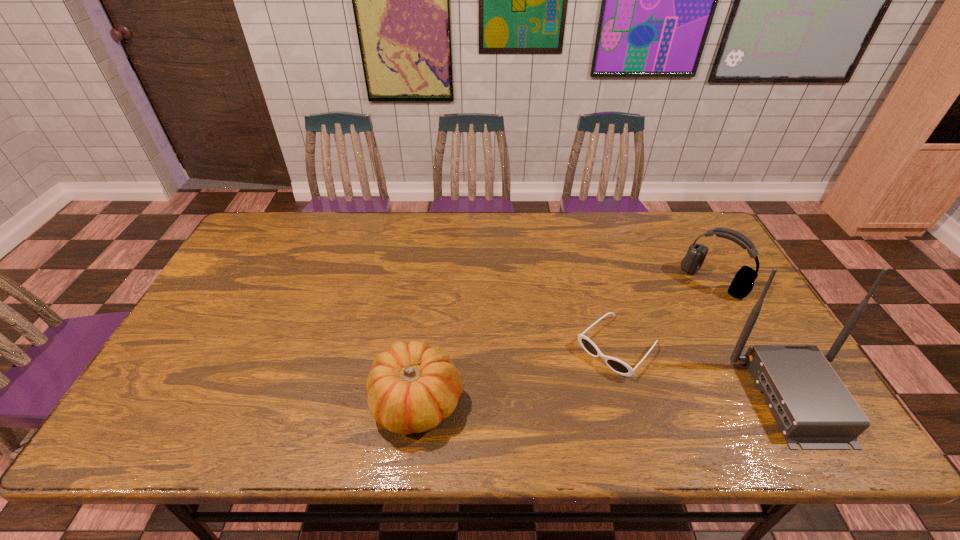
I want to click on free space on the desktop that is between the leftmost object and the router and is positioned with the lenses of the third object from right to left facing outward, so click(x=564, y=400).

Identify the location of vacant space on the desktop that is between the gourd and the tallest object and is positioned on the headband of the second tallest object. This screenshot has width=960, height=540. (598, 399).